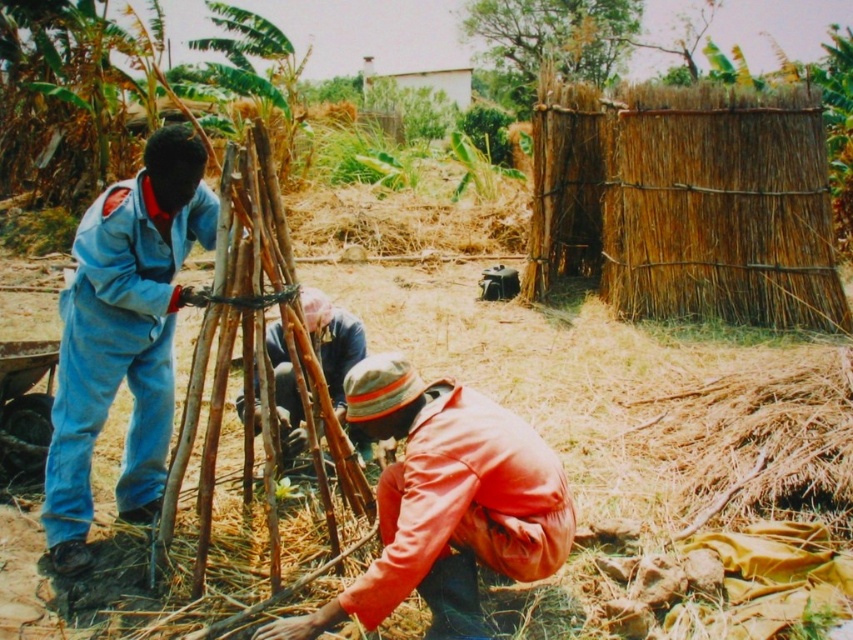
Question: Can you confirm if orange fabric at lower center is thinner than brown fabric at center?

Choices:
 (A) yes
 (B) no

Answer: (B)

Question: Is blue denim jumpsuit at left below brown fabric at center?

Choices:
 (A) yes
 (B) no

Answer: (B)

Question: Which point is closer to the camera taking this photo?

Choices:
 (A) (430, 474)
 (B) (137, 412)

Answer: (A)

Question: Among these objects, which one is farthest from the camera?

Choices:
 (A) orange fabric at lower center
 (B) blue denim jumpsuit at left
 (C) brown fabric at center

Answer: (C)

Question: Which point is closer to the camera?

Choices:
 (A) (341, 369)
 (B) (165, 284)

Answer: (B)

Question: Can you confirm if blue denim jumpsuit at left is positioned to the left of brown fabric at center?

Choices:
 (A) no
 (B) yes

Answer: (B)